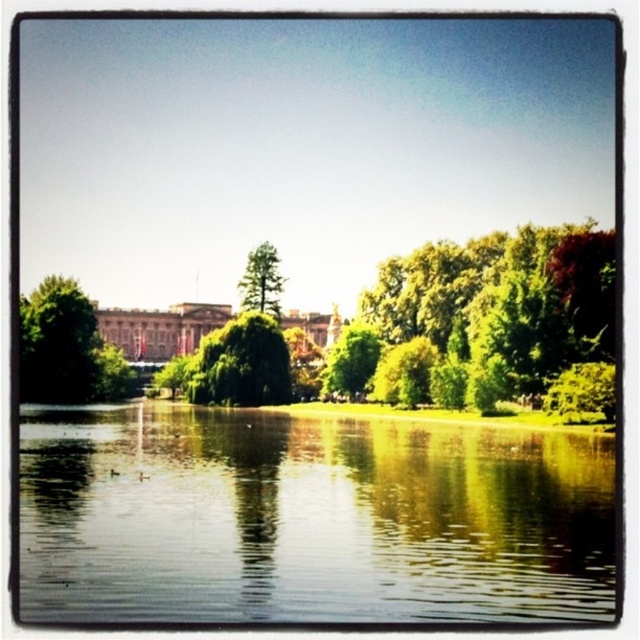
Question: Which point is closer to the camera?

Choices:
 (A) green leafy tree at left
 (B) brown stone palace at center
 (C) green matte tree at center
 (D) green leafy tree at center

Answer: (A)

Question: From the image, what is the correct spatial relationship of green leafy tree at center in relation to green matte tree at center?

Choices:
 (A) left
 (B) right

Answer: (B)

Question: Does green leafy tree at upper right appear under green matte tree at center?

Choices:
 (A) yes
 (B) no

Answer: (A)

Question: Is green leafy tree at center to the right of green matte tree at center from the viewer's perspective?

Choices:
 (A) yes
 (B) no

Answer: (A)

Question: Which object is farther from the camera taking this photo?

Choices:
 (A) green leafy tree at upper right
 (B) green leafy tree at center

Answer: (B)

Question: Estimate the real-world distances between objects in this image. Which object is farther from the brown stone palace at center?

Choices:
 (A) green leafy tree at center
 (B) green matte tree at center
 (C) transparent water at center
 (D) green leafy tree at left

Answer: (C)